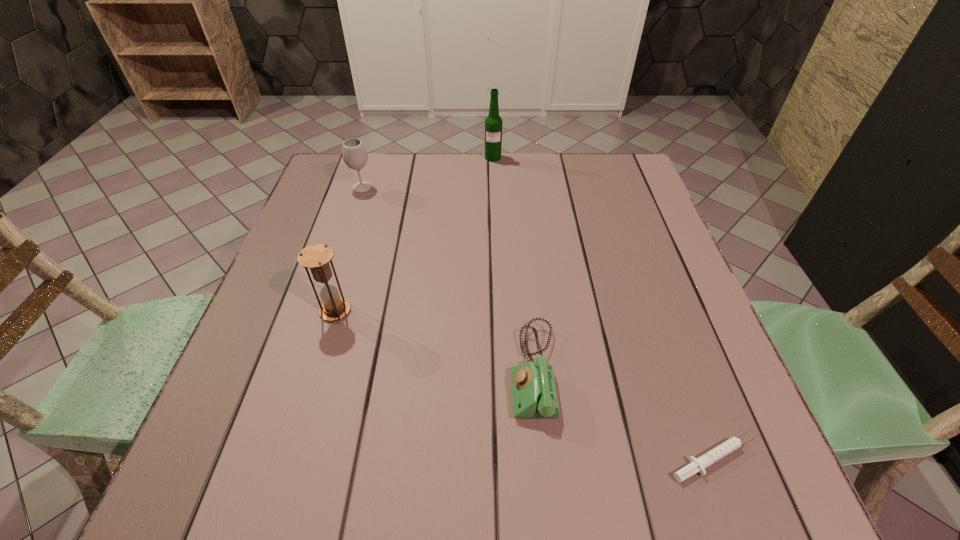
You are a GUI agent. You are given a task and a screenshot of the screen. Output one action in this format:
    pyautogui.click(x=<x>, y=<y>)
    Task: Click on the hourglass present at the left edge
    
    Given the screenshot: What is the action you would take?
    316,257

The image size is (960, 540). Find the location of `wineglass that is at the left edge`. wineglass that is at the left edge is located at coordinates (355, 156).

At what (x,y) coordinates should I click in order to perform the action: click on object at the right edge. Please return your answer as a coordinate pair (x, y). Looking at the image, I should click on (698, 465).

This screenshot has height=540, width=960. What are the coordinates of `object at the far left corner` in the screenshot? It's located at (355, 156).

Locate an element on the screen. object that is positioned at the near right corner is located at coordinates (698, 465).

Identify the location of free location at the far edge. 398,171.

Image resolution: width=960 pixels, height=540 pixels. In order to click on vacant space at the near edge of the desktop in this screenshot , I will do `click(428, 471)`.

Identify the location of free space at the left edge of the desktop. (288, 323).

Locate an element on the screen. Image resolution: width=960 pixels, height=540 pixels. free region at the right edge of the desktop is located at coordinates (689, 370).

Where is `vacant space at the far left corner`? The height and width of the screenshot is (540, 960). vacant space at the far left corner is located at coordinates (339, 173).